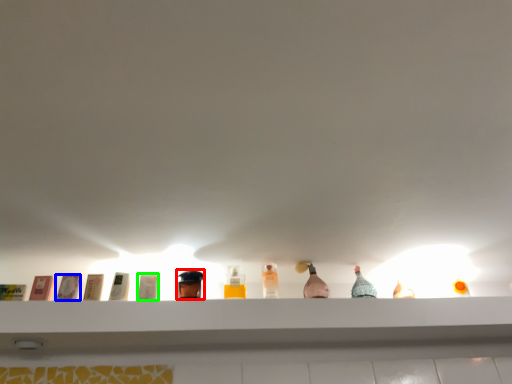
Question: Considering the real-world distances, which object is farthest from toiletry (highlighted by a red box)? toiletry (highlighted by a blue box) or toiletry (highlighted by a green box)?

Choices:
 (A) toiletry
 (B) toiletry

Answer: (A)